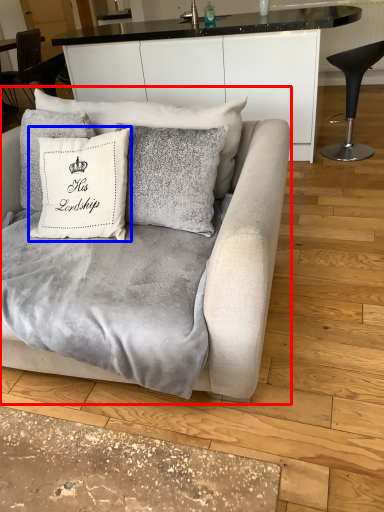
Question: Which point is further to the camera, studio couch (highlighted by a red box) or pillow (highlighted by a blue box)?

Choices:
 (A) studio couch
 (B) pillow

Answer: (B)